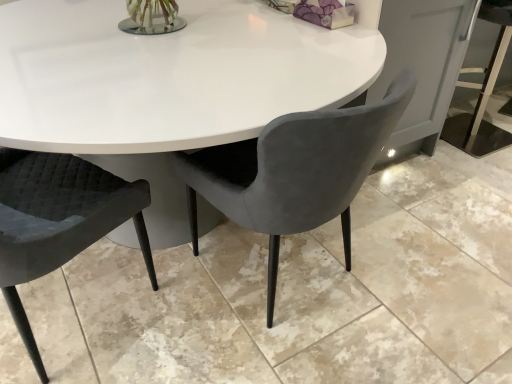
Question: Considering the relative positions of quilted black chair at lower left, which is the 2th chair from right to left, and velvet grey chair at center, acting as the second chair starting from the left, in the image provided, is quilted black chair at lower left, which is the 2th chair from right to left, to the right of velvet grey chair at center, acting as the second chair starting from the left, from the viewer's perspective?

Choices:
 (A) no
 (B) yes

Answer: (A)

Question: From a real-world perspective, does quilted black chair at lower left, the 1th chair when ordered from left to right, stand above velvet grey chair at center, acting as the second chair starting from the left?

Choices:
 (A) yes
 (B) no

Answer: (A)

Question: From the image's perspective, is quilted black chair at lower left, the 1th chair when ordered from left to right, above velvet grey chair at center, acting as the second chair starting from the left?

Choices:
 (A) yes
 (B) no

Answer: (B)

Question: Would you say quilted black chair at lower left, the 1th chair when ordered from left to right, is outside velvet grey chair at center, acting as the second chair starting from the left?

Choices:
 (A) yes
 (B) no

Answer: (A)

Question: Is the surface of quilted black chair at lower left, the 1th chair when ordered from left to right, in direct contact with velvet grey chair at center, which appears as the first chair when viewed from the right?

Choices:
 (A) yes
 (B) no

Answer: (B)

Question: From a real-world perspective, is quilted black chair at lower left, the 1th chair when ordered from left to right, below velvet grey chair at center, acting as the second chair starting from the left?

Choices:
 (A) no
 (B) yes

Answer: (A)

Question: Would you say velvet grey chair at center, which appears as the first chair when viewed from the right, contains quilted black chair at lower left, the 1th chair when ordered from left to right?

Choices:
 (A) yes
 (B) no

Answer: (B)

Question: Considering the relative sizes of velvet grey chair at center, which appears as the first chair when viewed from the right, and quilted black chair at lower left, which is the 2th chair from right to left, in the image provided, is velvet grey chair at center, which appears as the first chair when viewed from the right, thinner than quilted black chair at lower left, which is the 2th chair from right to left,?

Choices:
 (A) yes
 (B) no

Answer: (B)

Question: Considering the relative sizes of velvet grey chair at center, which appears as the first chair when viewed from the right, and quilted black chair at lower left, the 1th chair when ordered from left to right, in the image provided, is velvet grey chair at center, which appears as the first chair when viewed from the right, taller than quilted black chair at lower left, the 1th chair when ordered from left to right,?

Choices:
 (A) yes
 (B) no

Answer: (B)

Question: From a real-world perspective, is velvet grey chair at center, acting as the second chair starting from the left, on top of quilted black chair at lower left, the 1th chair when ordered from left to right?

Choices:
 (A) no
 (B) yes

Answer: (A)

Question: From the image's perspective, is velvet grey chair at center, acting as the second chair starting from the left, below quilted black chair at lower left, the 1th chair when ordered from left to right?

Choices:
 (A) no
 (B) yes

Answer: (A)

Question: Would you consider velvet grey chair at center, which appears as the first chair when viewed from the right, to be distant from quilted black chair at lower left, the 1th chair when ordered from left to right?

Choices:
 (A) no
 (B) yes

Answer: (A)

Question: Would you say velvet grey chair at center, which appears as the first chair when viewed from the right, is to the left or to the right of quilted black chair at lower left, the 1th chair when ordered from left to right, in the picture?

Choices:
 (A) left
 (B) right

Answer: (B)